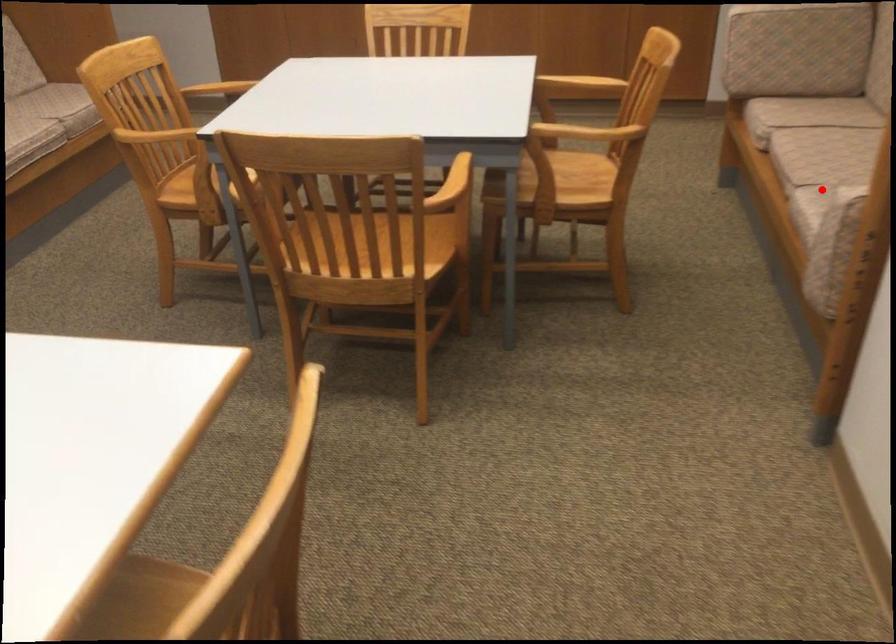
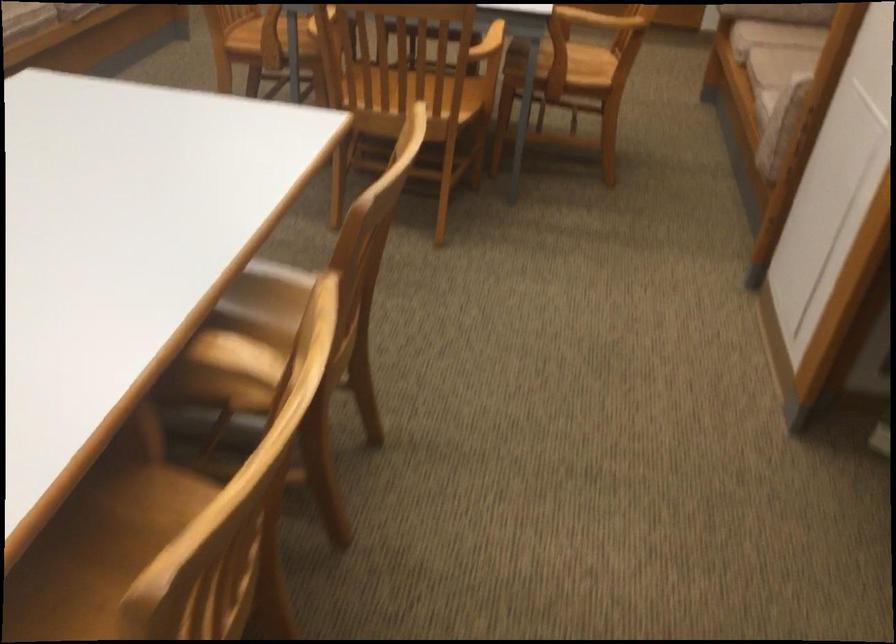
Question: I am providing you with two images of the same scene from different viewpoints. A red point is marked on the first image. Is the red point's position out of view in image 2?

Choices:
 (A) Yes
 (B) No

Answer: (A)